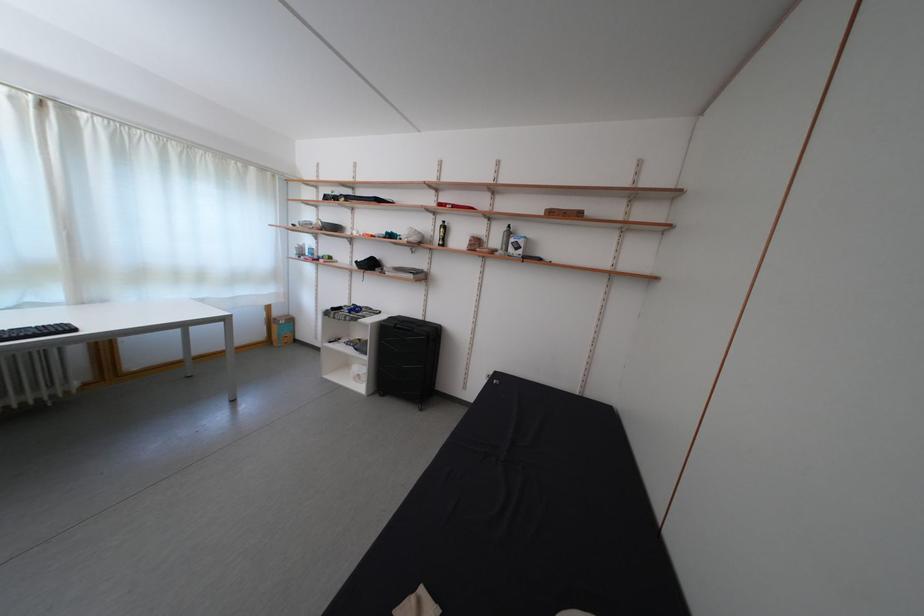
This screenshot has width=924, height=616. Describe the element at coordinates (282, 330) in the screenshot. I see `the small cardboard box` at that location.